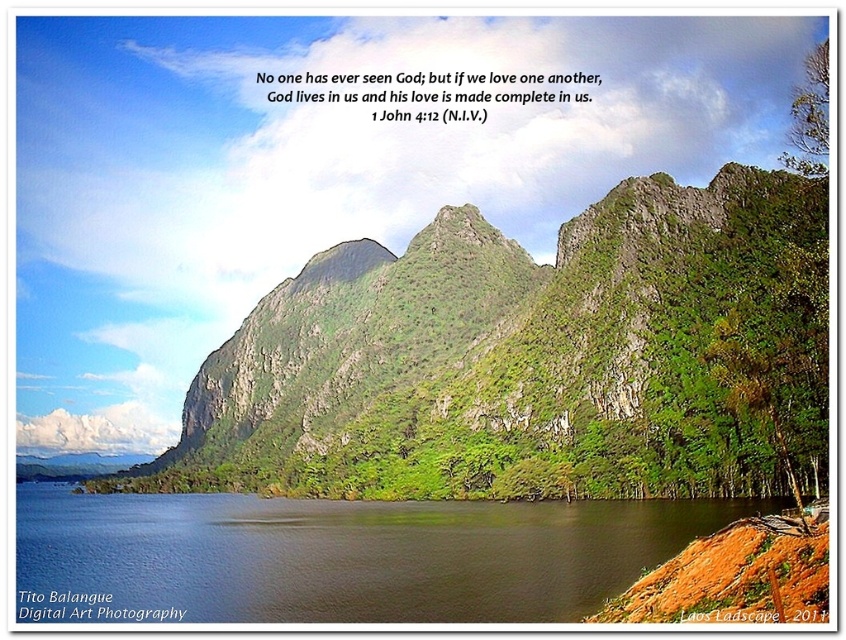
Question: Does green rocky mountain at center appear over blue water at lower left?

Choices:
 (A) no
 (B) yes

Answer: (B)

Question: Among these objects, which one is nearest to the camera?

Choices:
 (A) green rocky mountain at center
 (B) blue water at lower left

Answer: (B)

Question: Is green rocky mountain at center closer to the viewer compared to blue water at lower left?

Choices:
 (A) no
 (B) yes

Answer: (A)

Question: Among these points, which one is farthest from the camera?

Choices:
 (A) (378, 582)
 (B) (812, 326)

Answer: (B)

Question: Does green rocky mountain at center appear on the left side of blue water at lower left?

Choices:
 (A) yes
 (B) no

Answer: (B)